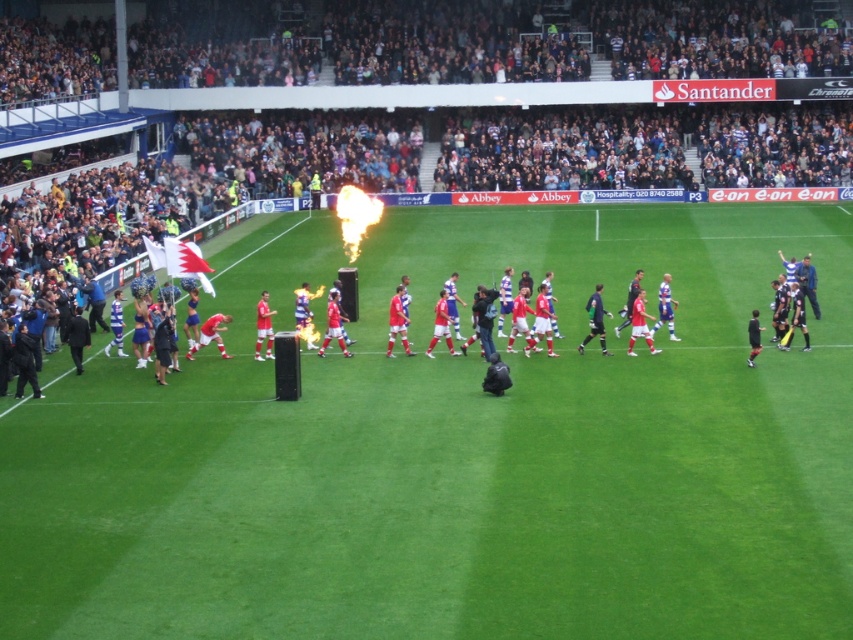
Between green grass field at center and smooth plastic flag at upper left, which one is positioned higher?

Positioned higher is smooth plastic flag at upper left.

Between green grass field at center and smooth plastic flag at upper left, which one has more height?

smooth plastic flag at upper left

Between point (421, 502) and point (672, 113), which one is positioned in front?

Positioned in front is point (421, 502).

Locate an element on the screen. Image resolution: width=853 pixels, height=640 pixels. green grass field at center is located at coordinates (459, 454).